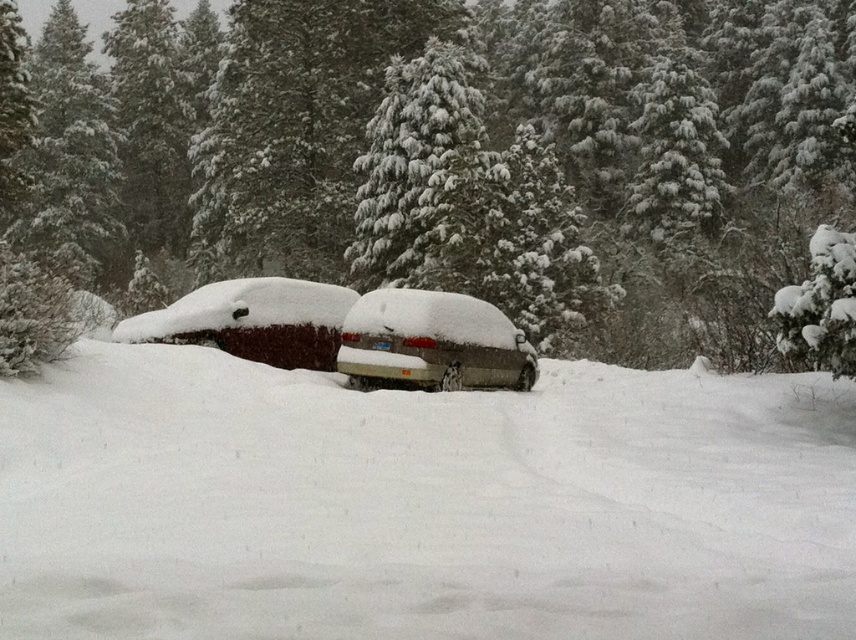
You are standing at the point where the snow is thickest. Looking at the scene, which object corresponds to the point marked at coordinates (x=464, y=152)?

The point at coordinates (x=464, y=152) corresponds to the snow covered evergreen tree at center.